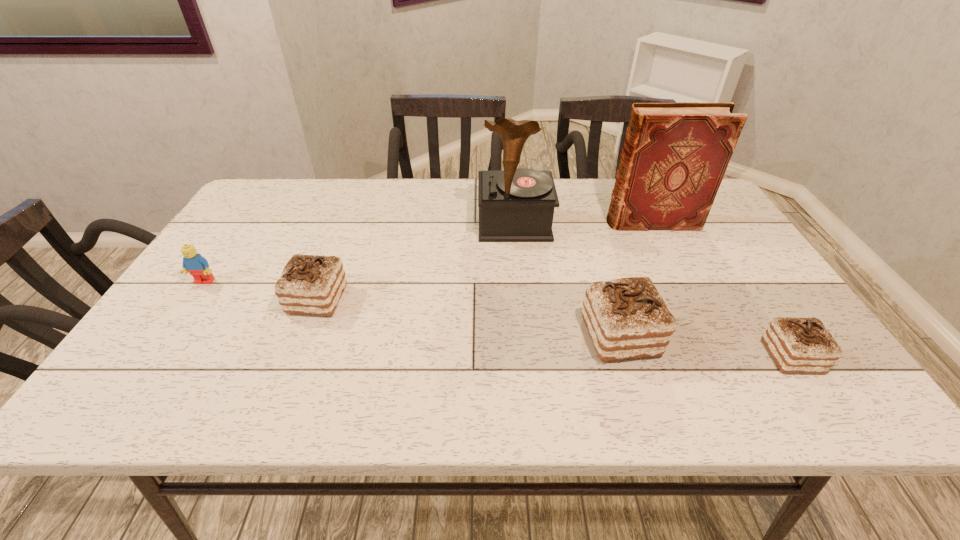
Where is `chocolate cake that is the nearest to the tallest chocolate cake`? chocolate cake that is the nearest to the tallest chocolate cake is located at coordinates (797, 345).

At what (x,y) coordinates should I click in order to perform the action: click on blank space that satisfies the following two spatial constraints: 1. at the horn opening of the tallest chocolate cake; 2. on the right side of the phonograph_record. Please return your answer as a coordinate pair (x, y). Looking at the image, I should click on (526, 336).

This screenshot has height=540, width=960. I want to click on free space in the image that satisfies the following two spatial constraints: 1. on the spine side of the rightmost chocolate cake; 2. on the left side of the hardback book, so click(719, 357).

Where is `free space that satisfies the following two spatial constraints: 1. at the horn opening of the second chocolate cake from left to right; 2. on the right side of the phonograph_record`? Image resolution: width=960 pixels, height=540 pixels. free space that satisfies the following two spatial constraints: 1. at the horn opening of the second chocolate cake from left to right; 2. on the right side of the phonograph_record is located at coordinates (526, 336).

Where is `free spot that satisfies the following two spatial constraints: 1. on the face of the Lego; 2. on the right side of the leftmost chocolate cake`? Image resolution: width=960 pixels, height=540 pixels. free spot that satisfies the following two spatial constraints: 1. on the face of the Lego; 2. on the right side of the leftmost chocolate cake is located at coordinates (192, 299).

Image resolution: width=960 pixels, height=540 pixels. I want to click on blank space that satisfies the following two spatial constraints: 1. on the face of the Lego; 2. on the right side of the second shortest chocolate cake, so click(x=192, y=299).

Where is `free point that satisfies the following two spatial constraints: 1. on the spine side of the hardback book; 2. on the front side of the tallest chocolate cake`? free point that satisfies the following two spatial constraints: 1. on the spine side of the hardback book; 2. on the front side of the tallest chocolate cake is located at coordinates (709, 336).